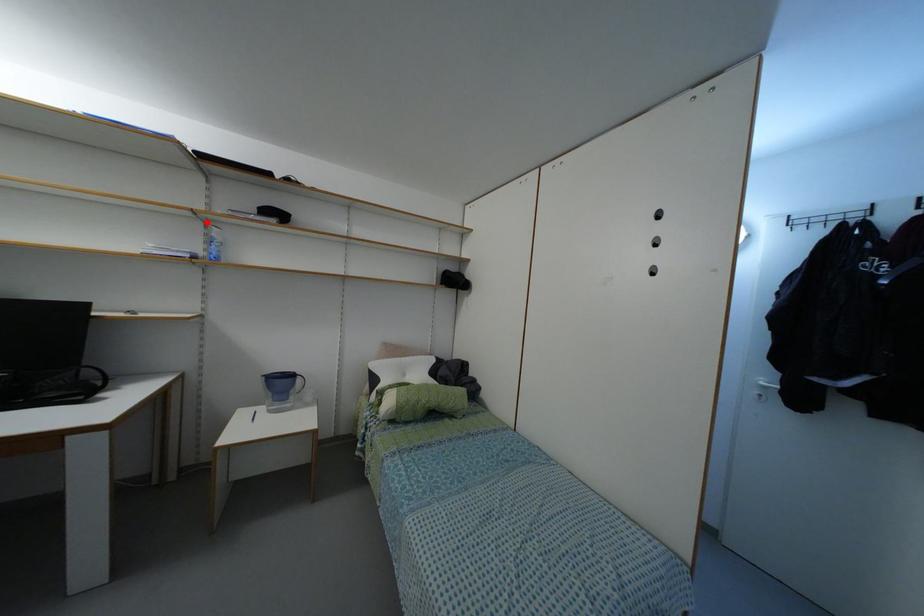
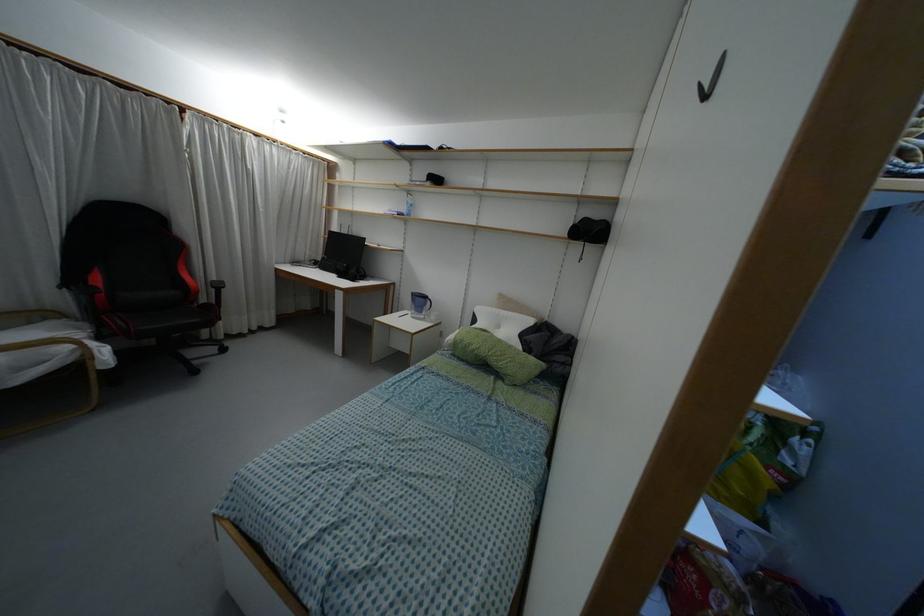
Question: I am providing you with two images of the same scene from different viewpoints. Given a red point in image1, look at the same physical point in image2. Is it:

Choices:
 (A) Closer to the viewpoint
 (B) Farther from the viewpoint

Answer: (A)